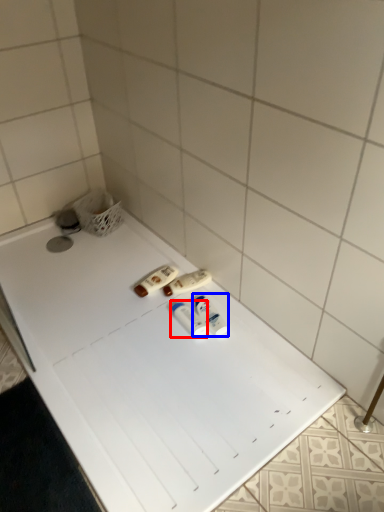
Question: Which of the following is the closest to the observer, toiletry (highlighted by a red box) or toiletry (highlighted by a blue box)?

Choices:
 (A) toiletry
 (B) toiletry

Answer: (A)